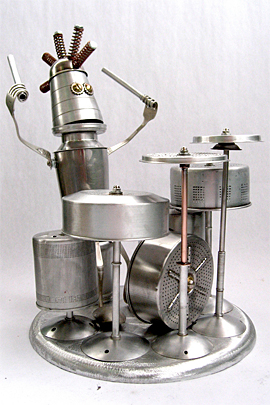
This screenshot has height=405, width=270. Find the location of `floor`. floor is located at coordinates (69, 394).